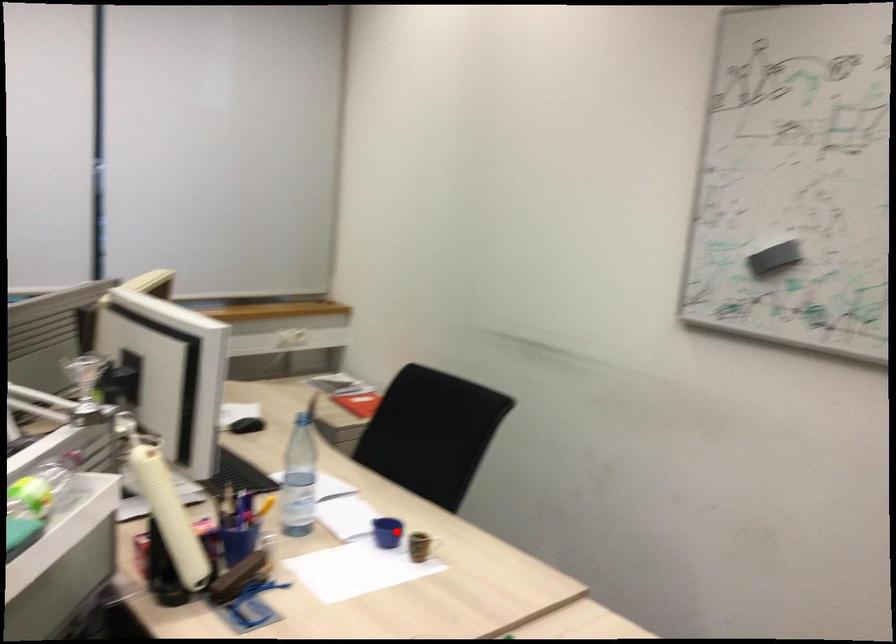
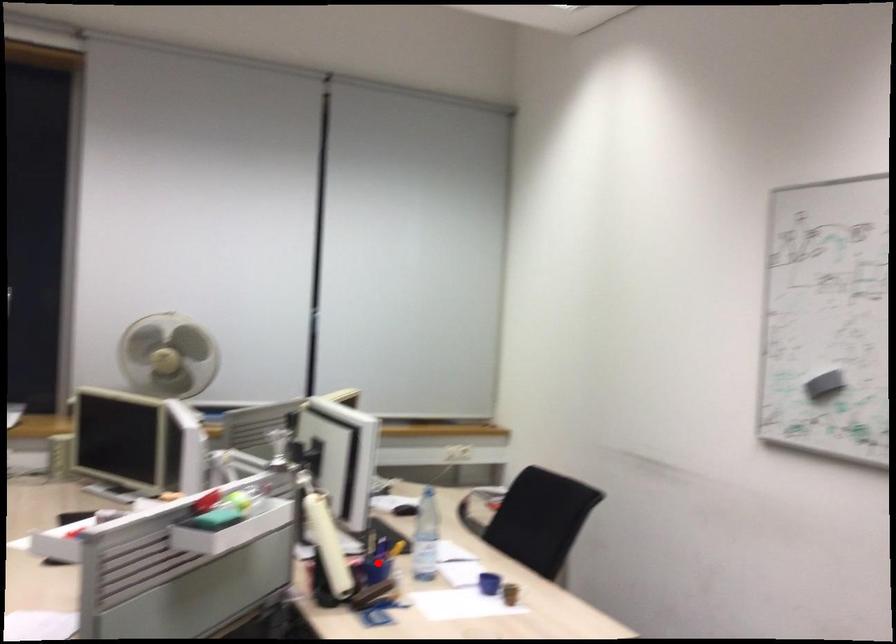
Looking at this image, I am providing you with two images of the same scene from different viewpoints. A red point is marked on the first image and another point is marked on the second image. Is the red point in image1 aligned with the point shown in image2?

No